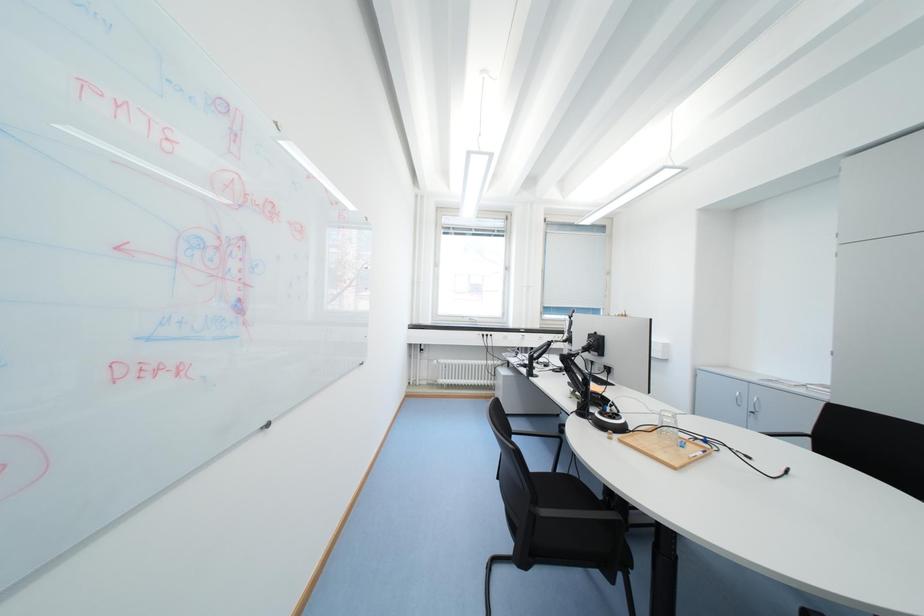
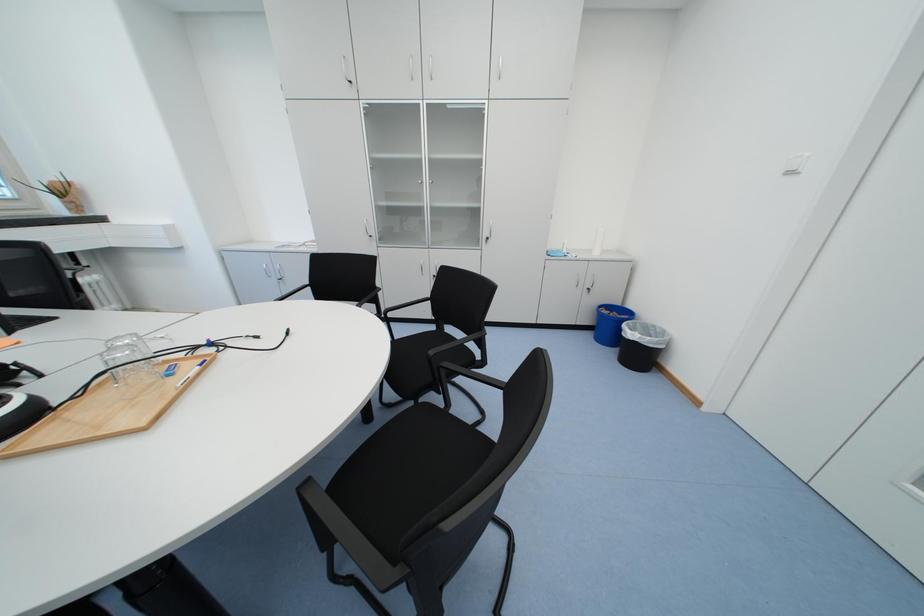
The first image is from the beginning of the video and the second image is from the end. How did the camera likely rotate when shooting the video?

The camera rotated toward right-down.